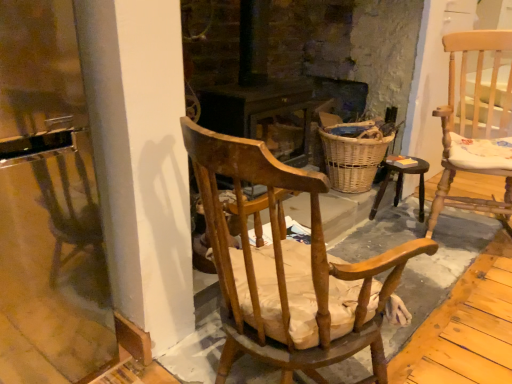
Where is `blank space situated above woven wicker basket at center (from a real-world perspective)`? blank space situated above woven wicker basket at center (from a real-world perspective) is located at coordinates (353, 130).